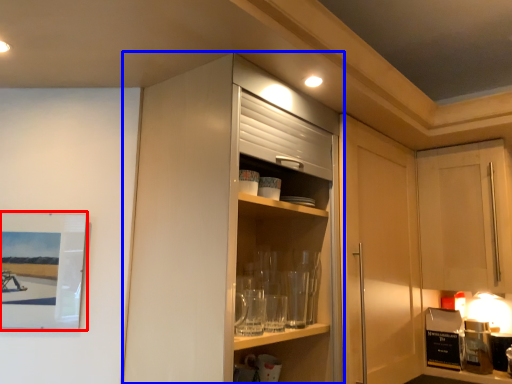
Question: Among these objects, which one is farthest to the camera, picture frame (highlighted by a red box) or cabinetry (highlighted by a blue box)?

Choices:
 (A) picture frame
 (B) cabinetry

Answer: (A)